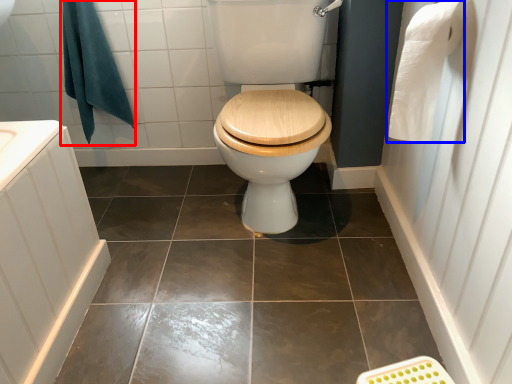
Question: Which point is further to the camera, bath towel (highlighted by a red box) or toilet paper (highlighted by a blue box)?

Choices:
 (A) bath towel
 (B) toilet paper

Answer: (A)